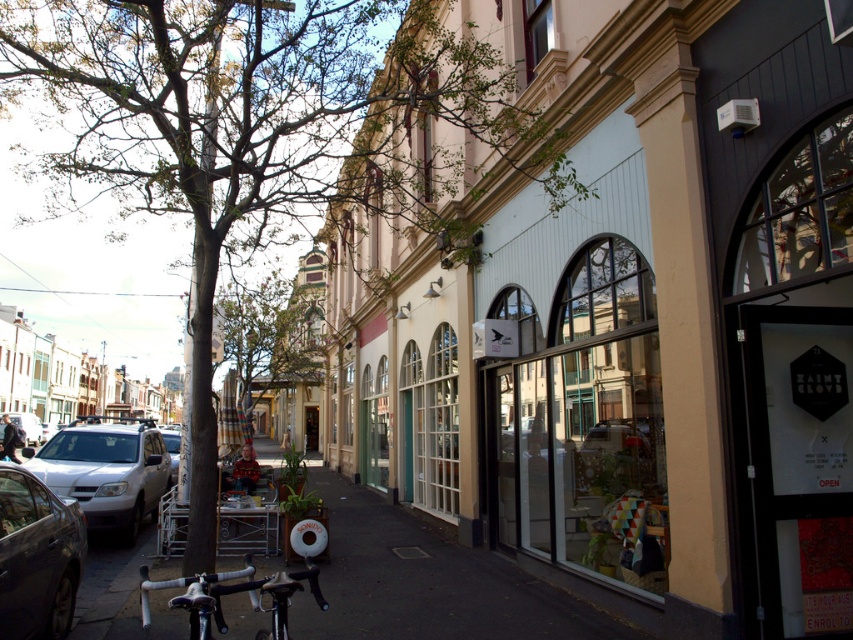
You are standing on the sidewalk and want to take a photo of the green leafy tree at center and dark gray asphalt at center. Which object will appear larger in the photo?

The green leafy tree at center will appear larger in the photo because it is closer to the viewer than the dark gray asphalt at center.

Based on the scene description, which object occupies more space in the image between the green leafy tree at center and the dark gray asphalt at center?

The green leafy tree at center has a larger size compared to the dark gray asphalt at center, so it occupies more space in the image.